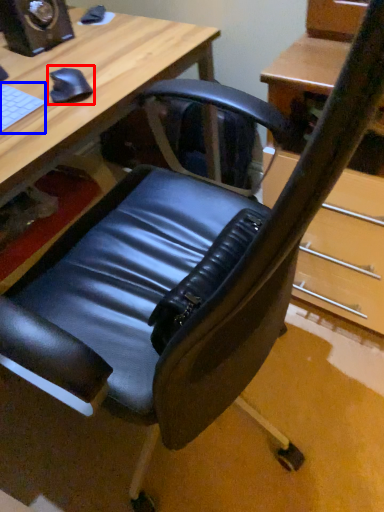
Question: Which object is further to the camera taking this photo, mouse (highlighted by a red box) or laptop keyboard (highlighted by a blue box)?

Choices:
 (A) mouse
 (B) laptop keyboard

Answer: (A)